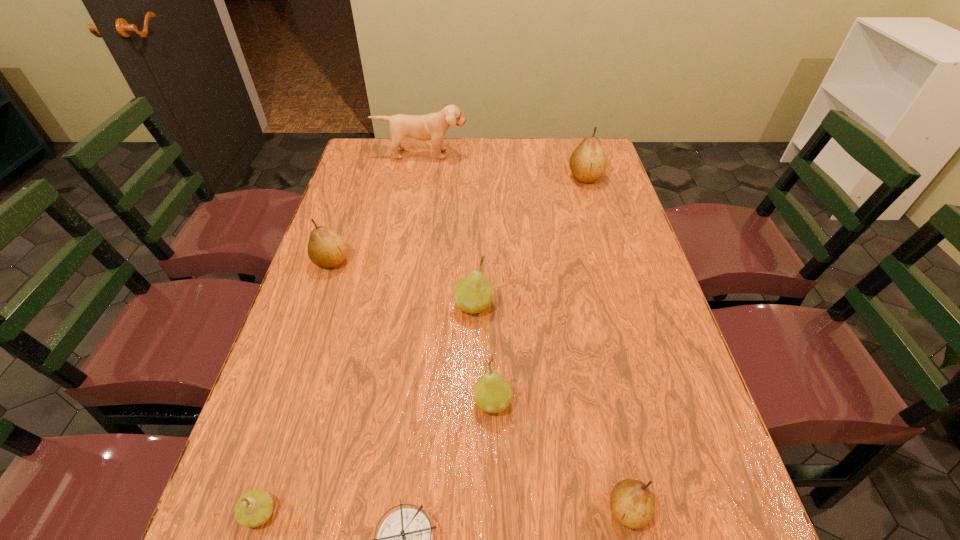
The height and width of the screenshot is (540, 960). I want to click on blank area located on the right of the smallest brown pear, so click(x=682, y=510).

This screenshot has height=540, width=960. Identify the location of puppy that is at the far edge. [x=433, y=126].

Image resolution: width=960 pixels, height=540 pixels. I want to click on pear that is positioned at the far edge, so click(588, 162).

Where is `puppy that is at the left edge`? puppy that is at the left edge is located at coordinates (433, 126).

What are the coordinates of `object situated at the far left corner` in the screenshot? It's located at (433, 126).

At what (x,y) coordinates should I click in order to perform the action: click on object that is at the far right corner. Please return your answer as a coordinate pair (x, y). The width and height of the screenshot is (960, 540). Looking at the image, I should click on (x=588, y=162).

At what (x,y) coordinates should I click in order to perform the action: click on vacant area at the far edge. Please return your answer as a coordinate pair (x, y). The height and width of the screenshot is (540, 960). Looking at the image, I should click on (526, 173).

Where is `vacant position at the left edge of the desktop`? The height and width of the screenshot is (540, 960). vacant position at the left edge of the desktop is located at coordinates (361, 306).

You are a GUI agent. You are given a task and a screenshot of the screen. Output one action in this format:
    pyautogui.click(x=<x>, y=<y>)
    Task: Click on the vacant space at the right edge of the desktop
    
    Given the screenshot: What is the action you would take?
    pyautogui.click(x=635, y=392)

Locate an element on the screen. vacant area that lies between the nearest brown pear and the third nearest pear is located at coordinates (560, 455).